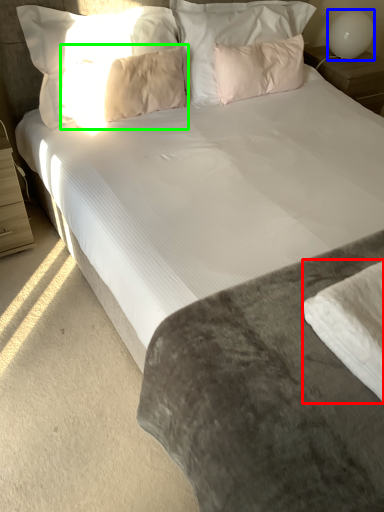
Question: Estimate the real-world distances between objects in this image. Which object is farther from sheet (highlighted by a red box), table lamp (highlighted by a blue box) or pillow (highlighted by a green box)?

Choices:
 (A) table lamp
 (B) pillow

Answer: (A)